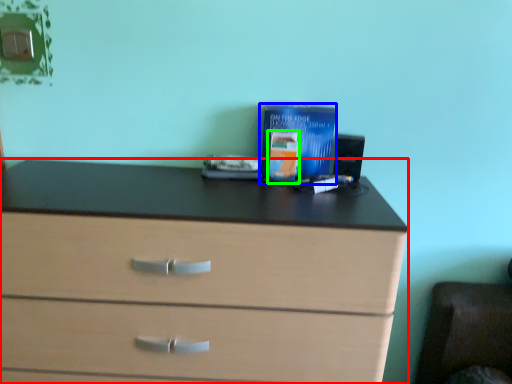
Question: Which is nearer to the chest of drawers (highlighted by a red box)? paperback book (highlighted by a blue box) or paperback book (highlighted by a green box).

Choices:
 (A) paperback book
 (B) paperback book

Answer: (A)